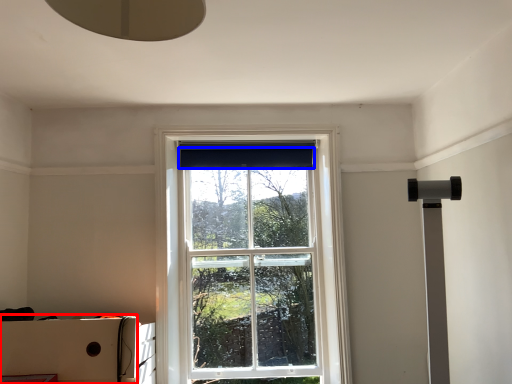
Question: Which object appears farthest to the camera in this image, cardboard box (highlighted by a red box) or curtain (highlighted by a blue box)?

Choices:
 (A) cardboard box
 (B) curtain

Answer: (B)